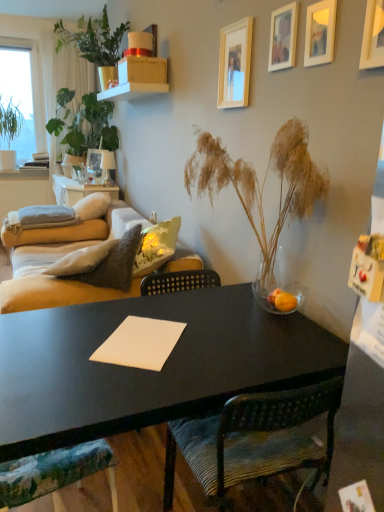
The width and height of the screenshot is (384, 512). Identify the location of wooden textured chair at lower left, placed as the second chair when sorted from right to left. (54, 472).

This screenshot has width=384, height=512. What do you see at coordinates (51, 281) in the screenshot? I see `velvet beige couch at center-left` at bounding box center [51, 281].

What are the coordinates of `wooden picture frame at upper center, positioned as the second picture frame in back-to-front order` in the screenshot? It's located at (235, 64).

Find the location of a particular element. wooden textured chair at lower left, placed as the second chair when sorted from right to left is located at coordinates (54, 472).

Considering the positions of points (3, 167) and (113, 483), is point (3, 167) closer to camera compared to point (113, 483)?

No, (3, 167) is behind (113, 483).

From a real-world perspective, which is physically above, green leafy plant at left, arranged as the 1th houseplant when viewed from the back, or wooden textured chair at lower left, the first chair positioned from the left?

From a 3D spatial view, green leafy plant at left, arranged as the 1th houseplant when viewed from the back, is above.

Where is `the 3rd houseplant to the left of the wooden textured chair at lower left, the first chair positioned from the left, starting your count from the anchor`? The image size is (384, 512). the 3rd houseplant to the left of the wooden textured chair at lower left, the first chair positioned from the left, starting your count from the anchor is located at coordinates (9, 131).

In the scene shown: Is green leafy plant at left, which is the first houseplant from left to right, looking in the opposite direction of wooden textured chair at lower left, the first chair positioned from the left?

No, wooden textured chair at lower left, the first chair positioned from the left, is not at the back of green leafy plant at left, which is the first houseplant from left to right.

Which of these two, wooden textured chair at lower left, the first chair positioned from the left, or green leafy plant at left, which is counted as the fourth houseplant, starting from the front, is wider?

Wider between the two is green leafy plant at left, which is counted as the fourth houseplant, starting from the front.

Which object is further away from the camera, wooden textured chair at lower left, the first chair positioned from the left, or green leafy plant at left, which is the first houseplant from left to right?

green leafy plant at left, which is the first houseplant from left to right, is more distant.

Which is closer to the camera, (8, 479) or (9, 109)?

Point (8, 479) is positioned closer to the camera compared to point (9, 109).

Considering the relative sizes of wooden textured chair at lower left, placed as the second chair when sorted from right to left, and green leafy plant at left, the 4th houseplant in the right-to-left sequence, in the image provided, is wooden textured chair at lower left, placed as the second chair when sorted from right to left, smaller than green leafy plant at left, the 4th houseplant in the right-to-left sequence,?

Indeed, wooden textured chair at lower left, placed as the second chair when sorted from right to left, has a smaller size compared to green leafy plant at left, the 4th houseplant in the right-to-left sequence.

Is matte glass photo frame at upper center, positioned as the fifth picture frame in right-to-left order, bigger than matte cardboard box at upper center?

Incorrect, matte glass photo frame at upper center, positioned as the fifth picture frame in right-to-left order, is not larger than matte cardboard box at upper center.

Locate an element on the screen. the 1st picture frame positioned below the matte cardboard box at upper center (from the image's perspective) is located at coordinates (97, 164).

Does matte glass photo frame at upper center, arranged as the first picture frame when viewed from the left, have a lesser width compared to matte cardboard box at upper center?

Yes, matte glass photo frame at upper center, arranged as the first picture frame when viewed from the left, is thinner than matte cardboard box at upper center.

From the image's perspective, who appears lower, wooden textured chair at lower left, the first chair positioned from the left, or white soft pillow at left, marked as the 2th pillow in a left-to-right arrangement?

From the image's view, wooden textured chair at lower left, the first chair positioned from the left, is below.

In the image, is wooden textured chair at lower left, the first chair positioned from the left, positioned in front of or behind white soft pillow at left, marked as the 2th pillow in a left-to-right arrangement?

Visually, wooden textured chair at lower left, the first chair positioned from the left, is located in front of white soft pillow at left, marked as the 2th pillow in a left-to-right arrangement.

Does wooden textured chair at lower left, the first chair positioned from the left, appear on the right side of white soft pillow at left, marked as the 2th pillow in a left-to-right arrangement?

Yes.

Considering the sizes of objects wooden textured chair at lower left, the first chair positioned from the left, and white soft pillow at left, marked as the 2th pillow in a left-to-right arrangement, in the image provided, who is thinner, wooden textured chair at lower left, the first chair positioned from the left, or white soft pillow at left, marked as the 2th pillow in a left-to-right arrangement,?

wooden textured chair at lower left, the first chair positioned from the left, is thinner.

Between matte beige sofa at left and wooden picture frame at upper right, the second picture frame in the right-to-left sequence, which one has smaller width?

With smaller width is wooden picture frame at upper right, the second picture frame in the right-to-left sequence.

Would you say matte beige sofa at left is outside wooden picture frame at upper right, the second picture frame in the right-to-left sequence?

That's correct, matte beige sofa at left is outside of wooden picture frame at upper right, the second picture frame in the right-to-left sequence.

Which is closer, (86, 190) or (326, 60)?

Positioned in front is point (326, 60).

In terms of size, does matte beige sofa at left appear bigger or smaller than wooden picture frame at upper right, the 4th picture frame in the left-to-right sequence?

In the image, matte beige sofa at left appears to be larger than wooden picture frame at upper right, the 4th picture frame in the left-to-right sequence.

Are wooden picture frame at upper center, positioned as the second picture frame in left-to-right order, and green leafy plant at upper left, the 3th houseplant viewed from the back, far apart?

Yes, wooden picture frame at upper center, positioned as the second picture frame in left-to-right order, and green leafy plant at upper left, the 3th houseplant viewed from the back, are located far from each other.

Could you measure the distance between wooden picture frame at upper center, positioned as the second picture frame in left-to-right order, and green leafy plant at upper left, the 3th houseplant viewed from the back?

wooden picture frame at upper center, positioned as the second picture frame in left-to-right order, and green leafy plant at upper left, the 3th houseplant viewed from the back, are 1.87 meters apart.

From a real-world perspective, is wooden picture frame at upper center, positioned as the second picture frame in left-to-right order, under green leafy plant at upper left, placed as the 3th houseplant when sorted from left to right?

Yes, from a real-world perspective, wooden picture frame at upper center, positioned as the second picture frame in left-to-right order, is under green leafy plant at upper left, placed as the 3th houseplant when sorted from left to right.

How different are the orientations of wooden picture frame at upper center, positioned as the second picture frame in back-to-front order, and green leafy plant at upper left, placed as the 3th houseplant when sorted from left to right, in degrees?

The angular difference between wooden picture frame at upper center, positioned as the second picture frame in back-to-front order, and green leafy plant at upper left, placed as the 3th houseplant when sorted from left to right, is 0.00565 degrees.

How distant is wooden picture frame at upper center, the 4th picture frame from the front, from wooden textured chair at lower left, the first chair positioned from the left?

wooden picture frame at upper center, the 4th picture frame from the front, and wooden textured chair at lower left, the first chair positioned from the left, are 1.60 meters apart from each other.

Visually, is wooden picture frame at upper center, positioned as the second picture frame in left-to-right order, positioned to the left or to the right of wooden textured chair at lower left, the first chair positioned from the left?

Clearly, wooden picture frame at upper center, positioned as the second picture frame in left-to-right order, is on the right of wooden textured chair at lower left, the first chair positioned from the left, in the image.

Which object is closer to the camera taking this photo, wooden picture frame at upper center, arranged as the 4th picture frame when viewed from the right, or wooden textured chair at lower left, the first chair positioned from the left?

wooden textured chair at lower left, the first chair positioned from the left, is more forward.

How different are the orientations of wooden picture frame at upper center, arranged as the 4th picture frame when viewed from the right, and wooden textured chair at lower left, placed as the second chair when sorted from right to left, in degrees?

The angle between the facing direction of wooden picture frame at upper center, arranged as the 4th picture frame when viewed from the right, and the facing direction of wooden textured chair at lower left, placed as the second chair when sorted from right to left, is 171 degrees.

The width and height of the screenshot is (384, 512). I want to click on houseplant that is the 3rd one when counting backward from the wooden textured chair at lower left, the first chair positioned from the left, so click(x=9, y=131).

Where is `houseplant that is the 3rd one when counting leftward from the wooden textured chair at lower left, placed as the second chair when sorted from right to left`? This screenshot has height=512, width=384. houseplant that is the 3rd one when counting leftward from the wooden textured chair at lower left, placed as the second chair when sorted from right to left is located at coordinates (9, 131).

Which object lies nearer to the anchor point white soft pillow at left, marked as the 2th pillow in a left-to-right arrangement, wooden picture frame at upper right, the first picture frame viewed from the front, or striped fabric chair at center, which appears as the 1th chair when viewed from the right?

striped fabric chair at center, which appears as the 1th chair when viewed from the right.

From the image, which object appears to be farther from green leafy plant at left, which is the first houseplant from left to right, green matte plant at upper left, the 2th houseplant when ordered from back to front, or orange matte glass at center?

The object further to green leafy plant at left, which is the first houseplant from left to right, is orange matte glass at center.

Based on their spatial positions, is orange matte glass at center or matte beige sofa at left closer to wooden picture frame at upper center, which is counted as the 3th picture frame, starting from the right?

Based on the image, orange matte glass at center appears to be nearer to wooden picture frame at upper center, which is counted as the 3th picture frame, starting from the right.

Looking at the image, which one is located closer to matte glass photo frame at upper center, positioned as the fifth picture frame in right-to-left order, wooden picture frame at upper right, the first picture frame viewed from the front, or matte cardboard box at upper center?

Based on the image, matte cardboard box at upper center appears to be nearer to matte glass photo frame at upper center, positioned as the fifth picture frame in right-to-left order.

From the image, which object appears to be farther from matte glass photo frame at upper center, positioned as the fifth picture frame in right-to-left order, matte cardboard box at upper center or green leafy plant at left, which is counted as the fourth houseplant, starting from the front?

green leafy plant at left, which is counted as the fourth houseplant, starting from the front, is further to matte glass photo frame at upper center, positioned as the fifth picture frame in right-to-left order.

Based on their spatial positions, is matte beige sofa at left or wooden picture frame at upper right, the 4th picture frame in the left-to-right sequence, further from green matte plant at upper left, the 2th houseplant when ordered from back to front?

Among the two, wooden picture frame at upper right, the 4th picture frame in the left-to-right sequence, is located further to green matte plant at upper left, the 2th houseplant when ordered from back to front.

Based on their spatial positions, is green matte plant at upper left, the 2th houseplant when ordered from left to right, or green leafy plant at upper left, positioned as the second houseplant in front-to-back order, closer to matte glass photo frame at upper center, positioned as the fifth picture frame in right-to-left order?

green matte plant at upper left, the 2th houseplant when ordered from left to right, is closer to matte glass photo frame at upper center, positioned as the fifth picture frame in right-to-left order.

When comparing their distances from wooden picture frame at upper right, the first picture frame viewed from the front, does matte cardboard box at upper center or gray fabric pillow at left, the second pillow viewed from the right, seem closer?

The object closer to wooden picture frame at upper right, the first picture frame viewed from the front, is matte cardboard box at upper center.

I want to click on box between translucent glass vase at center, which ranks as the first houseplant in front-to-back order, and white soft pillow at left, marked as the 2th pillow in a left-to-right arrangement, in the front-back direction, so click(142, 70).

What are the coordinates of `desk positioned between wooden picture frame at upper center, positioned as the second picture frame in left-to-right order, and matte glass photo frame at upper center, arranged as the first picture frame when viewed from the left, from near to far` in the screenshot? It's located at (78, 190).

Find the location of a particular element. Image resolution: width=384 pixels, height=512 pixels. studio couch between wooden picture frame at upper right, the first picture frame viewed from the front, and gray fabric pillow at left, the second pillow viewed from the right, along the z-axis is located at coordinates (51, 281).

This screenshot has width=384, height=512. What are the coordinates of `studio couch between striped fabric chair at center, which appears as the 1th chair when viewed from the right, and matte glass photo frame at upper center, marked as the 1th picture frame in a back-to-front arrangement, along the z-axis` in the screenshot? It's located at (51, 281).